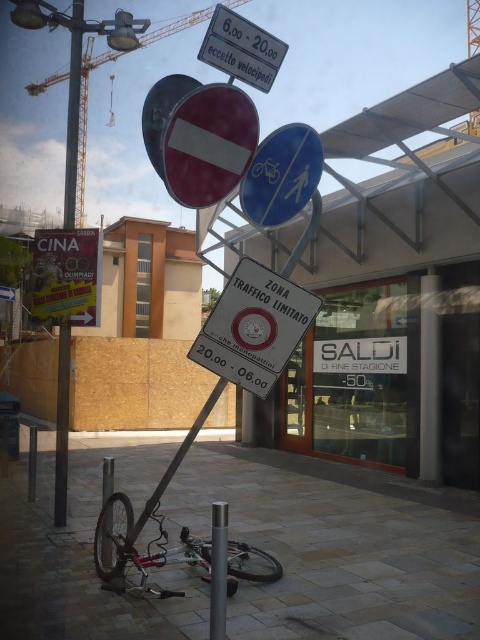
You are a delivery person who needs to park your silver metallic bicycle at center. The parking area is located at point [135,548]. Is the parking area suitable for your bicycle?

The point [135,548] corresponds to the silver metallic bicycle at center, so the parking area is suitable for your bicycle.

You are a delivery person trying to navigate through the urban area shown. You see the blue plastic bicycle and pedestrian sign at center and the brushed metal crane at upper left. Which object is located to the right of the other?

The blue plastic bicycle and pedestrian sign at center is positioned on the right side of the brushed metal crane at upper left.

You are a delivery person who needs to place a sticker on the blue plastic bicycle and pedestrian sign at center. The sticker must be placed at the point with coordinates point (282, 176). Is this point located on the correct sign?

Yes, the point (282, 176) is on the blue plastic bicycle and pedestrian sign at center, so the sticker should be placed there.